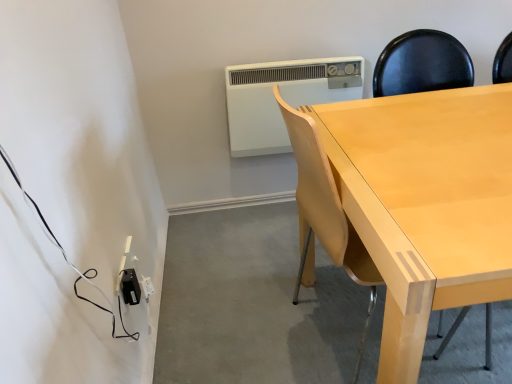
Question: From the image's perspective, relative to black plastic power adapter at lower left, is light wood chair at center above or below?

Choices:
 (A) below
 (B) above

Answer: (B)

Question: From their relative heights in the image, would you say light wood chair at center is taller or shorter than black plastic power adapter at lower left?

Choices:
 (A) tall
 (B) short

Answer: (A)

Question: Estimate the real-world distances between objects in this image. Which object is farther from the black plastic power adapter at lower left?

Choices:
 (A) light wood chair at center
 (B) white plastic air conditioning unit at upper center

Answer: (B)

Question: Which of these objects is positioned farthest from the black plastic power adapter at lower left?

Choices:
 (A) white plastic air conditioning unit at upper center
 (B) light wood chair at center

Answer: (A)